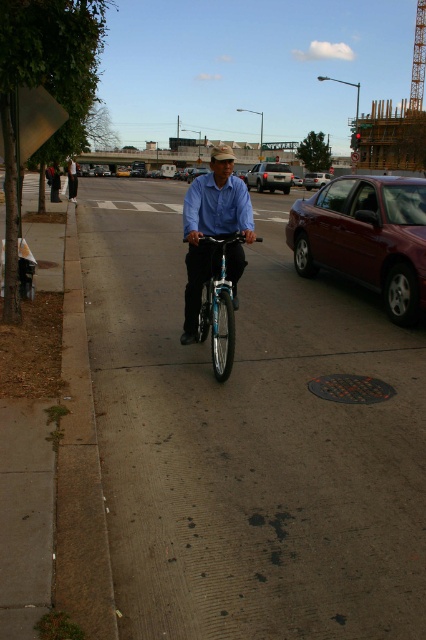
Question: Which point is farther to the camera?

Choices:
 (A) (356, 490)
 (B) (221, 289)
 (C) (324, 177)

Answer: (C)

Question: Which object is positioned farthest from the shiny blue bicycle at center?

Choices:
 (A) metallic silver sedan at center
 (B) shiny maroon sedan at right

Answer: (A)

Question: Which of these objects is positioned closest to the gray concrete sidewalk at center?

Choices:
 (A) matte silver suv at center
 (B) metallic silver sedan at center
 (C) shiny blue bicycle at center
 (D) shiny maroon sedan at right

Answer: (D)

Question: Is shiny maroon sedan at right to the left of matte blue shirt at center from the viewer's perspective?

Choices:
 (A) yes
 (B) no

Answer: (B)

Question: Does shiny maroon sedan at right appear over shiny blue bicycle at center?

Choices:
 (A) no
 (B) yes

Answer: (B)

Question: Does matte blue shirt at center have a greater width compared to metallic silver sedan at center?

Choices:
 (A) yes
 (B) no

Answer: (B)